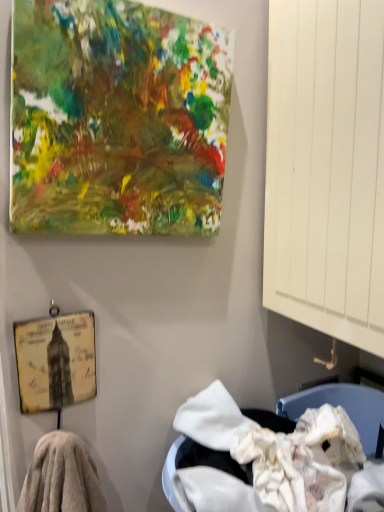
This screenshot has height=512, width=384. What are the coordinates of `abstract multicolored canvas at upper left` in the screenshot? It's located at (116, 119).

At what (x,y) coordinates should I click in order to perform the action: click on fuzzy towel at lower left. Please return your answer as a coordinate pair (x, y). Image resolution: width=384 pixels, height=512 pixels. Looking at the image, I should click on (62, 477).

Does yellowed paper picture frame at lower left have a lesser height compared to fuzzy towel at lower left?

Indeed, yellowed paper picture frame at lower left has a lesser height compared to fuzzy towel at lower left.

Which object is more forward, yellowed paper picture frame at lower left or fuzzy towel at lower left?

Positioned in front is fuzzy towel at lower left.

Between yellowed paper picture frame at lower left and fuzzy towel at lower left, which one has smaller width?

Thinner between the two is yellowed paper picture frame at lower left.

Locate an element on the screen. Image resolution: width=384 pixels, height=512 pixels. picture frame behind the fuzzy towel at lower left is located at coordinates (55, 361).

Is fuzzy towel at lower left oriented away from abstract multicolored canvas at upper left?

No, abstract multicolored canvas at upper left is not at the back of fuzzy towel at lower left.

Based on the photo, which is behind, fuzzy towel at lower left or abstract multicolored canvas at upper left?

fuzzy towel at lower left is further away from the camera.

Locate an element on the screen. The image size is (384, 512). oil painting on the right of fuzzy towel at lower left is located at coordinates (116, 119).

From the picture: Between fuzzy towel at lower left and yellowed paper picture frame at lower left, which one appears on the right side from the viewer's perspective?

From the viewer's perspective, fuzzy towel at lower left appears more on the right side.

Considering the sizes of fuzzy towel at lower left and yellowed paper picture frame at lower left in the image, is fuzzy towel at lower left bigger or smaller than yellowed paper picture frame at lower left?

fuzzy towel at lower left is bigger than yellowed paper picture frame at lower left.

From the image's perspective, which is above, fuzzy towel at lower left or yellowed paper picture frame at lower left?

yellowed paper picture frame at lower left appears higher in the image.

Is point (58, 507) more distant than point (40, 365)?

Yes, point (58, 507) is farther from viewer.

Considering the sizes of objects yellowed paper picture frame at lower left and abstract multicolored canvas at upper left in the image provided, who is wider, yellowed paper picture frame at lower left or abstract multicolored canvas at upper left?

abstract multicolored canvas at upper left.

Choose the correct answer: Is yellowed paper picture frame at lower left inside abstract multicolored canvas at upper left or outside it?

yellowed paper picture frame at lower left cannot be found inside abstract multicolored canvas at upper left.

Between yellowed paper picture frame at lower left and abstract multicolored canvas at upper left, which one is positioned behind?

yellowed paper picture frame at lower left is further from the camera.

Between yellowed paper picture frame at lower left and abstract multicolored canvas at upper left, which one has larger size?

abstract multicolored canvas at upper left is bigger.

Is abstract multicolored canvas at upper left taller or shorter than yellowed paper picture frame at lower left?

Considering their sizes, abstract multicolored canvas at upper left has more height than yellowed paper picture frame at lower left.

In terms of size, does abstract multicolored canvas at upper left appear bigger or smaller than yellowed paper picture frame at lower left?

abstract multicolored canvas at upper left is bigger than yellowed paper picture frame at lower left.

Considering the sizes of objects abstract multicolored canvas at upper left and yellowed paper picture frame at lower left in the image provided, who is wider, abstract multicolored canvas at upper left or yellowed paper picture frame at lower left?

Wider between the two is abstract multicolored canvas at upper left.

How many degrees apart are the facing directions of abstract multicolored canvas at upper left and yellowed paper picture frame at lower left?

abstract multicolored canvas at upper left and yellowed paper picture frame at lower left are facing 1.67 degrees away from each other.

Is abstract multicolored canvas at upper left facing away from fuzzy towel at lower left?

abstract multicolored canvas at upper left does not have its back to fuzzy towel at lower left.

Considering the sizes of objects abstract multicolored canvas at upper left and fuzzy towel at lower left in the image provided, who is shorter, abstract multicolored canvas at upper left or fuzzy towel at lower left?

With less height is fuzzy towel at lower left.

Is the surface of abstract multicolored canvas at upper left in direct contact with fuzzy towel at lower left?

There is a gap between abstract multicolored canvas at upper left and fuzzy towel at lower left.

Locate an element on the screen. This screenshot has height=512, width=384. material that is in front of the yellowed paper picture frame at lower left is located at coordinates (62, 477).

Where is `material located underneath the abstract multicolored canvas at upper left (from a real-world perspective)`? material located underneath the abstract multicolored canvas at upper left (from a real-world perspective) is located at coordinates (62, 477).

Which object lies nearer to the anchor point abstract multicolored canvas at upper left, fuzzy towel at lower left or yellowed paper picture frame at lower left?

yellowed paper picture frame at lower left is positioned closer to the anchor abstract multicolored canvas at upper left.

Looking at this image, when comparing their distances from yellowed paper picture frame at lower left, does fuzzy towel at lower left or abstract multicolored canvas at upper left seem further?

Based on the image, abstract multicolored canvas at upper left appears to be further to yellowed paper picture frame at lower left.

Estimate the real-world distances between objects in this image. Which object is further from fuzzy towel at lower left, abstract multicolored canvas at upper left or yellowed paper picture frame at lower left?

abstract multicolored canvas at upper left.

Based on their spatial positions, is abstract multicolored canvas at upper left or fuzzy towel at lower left further from yellowed paper picture frame at lower left?

abstract multicolored canvas at upper left lies further to yellowed paper picture frame at lower left than the other object.

Which object lies nearer to the anchor point fuzzy towel at lower left, yellowed paper picture frame at lower left or abstract multicolored canvas at upper left?

Based on the image, yellowed paper picture frame at lower left appears to be nearer to fuzzy towel at lower left.

Based on their spatial positions, is yellowed paper picture frame at lower left or fuzzy towel at lower left further from abstract multicolored canvas at upper left?

fuzzy towel at lower left.

The height and width of the screenshot is (512, 384). Find the location of `picture frame between abstract multicolored canvas at upper left and fuzzy towel at lower left in the up-down direction`. picture frame between abstract multicolored canvas at upper left and fuzzy towel at lower left in the up-down direction is located at coordinates (55, 361).